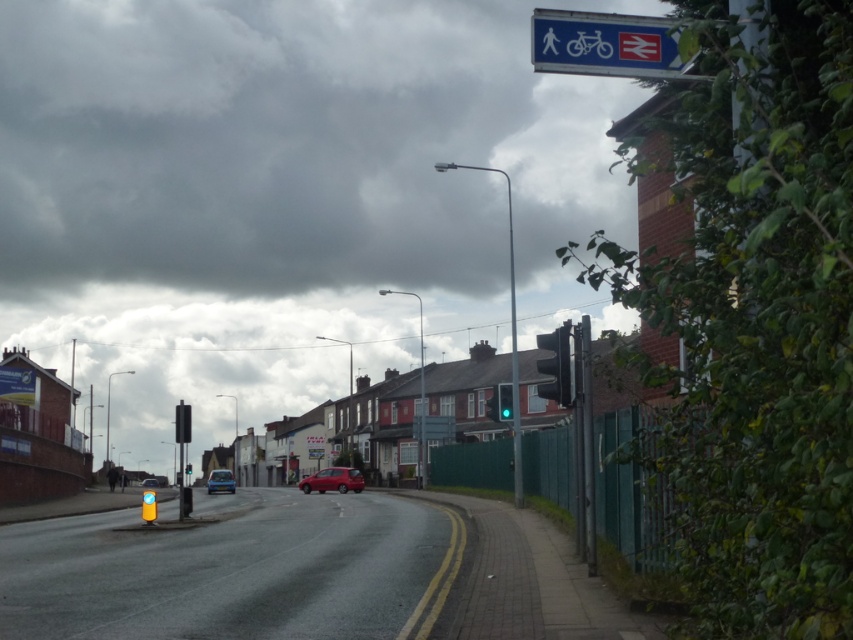
Question: Which object is positioned closest to the matte blue car at center?

Choices:
 (A) green glass traffic light at center-right
 (B) black matte traffic light at right
 (C) black plastic traffic light at left

Answer: (A)

Question: Observing the image, what is the correct spatial positioning of black plastic traffic light at left in reference to green glass traffic light at center-right?

Choices:
 (A) below
 (B) above

Answer: (A)

Question: Does black matte traffic light at right appear under black plastic traffic light at left?

Choices:
 (A) no
 (B) yes

Answer: (A)

Question: Estimate the real-world distances between objects in this image. Which object is closer to the green glass traffic light at upper center?

Choices:
 (A) black matte traffic light at right
 (B) matte blue car at center
 (C) metallic blue car at center

Answer: (B)

Question: Which of these objects is positioned farthest from the matte blue car at center?

Choices:
 (A) green glass traffic light at center-right
 (B) metallic blue car at center
 (C) shiny red car at center

Answer: (B)

Question: Is black matte traffic light at right thinner than green glass traffic light at center-right?

Choices:
 (A) no
 (B) yes

Answer: (A)